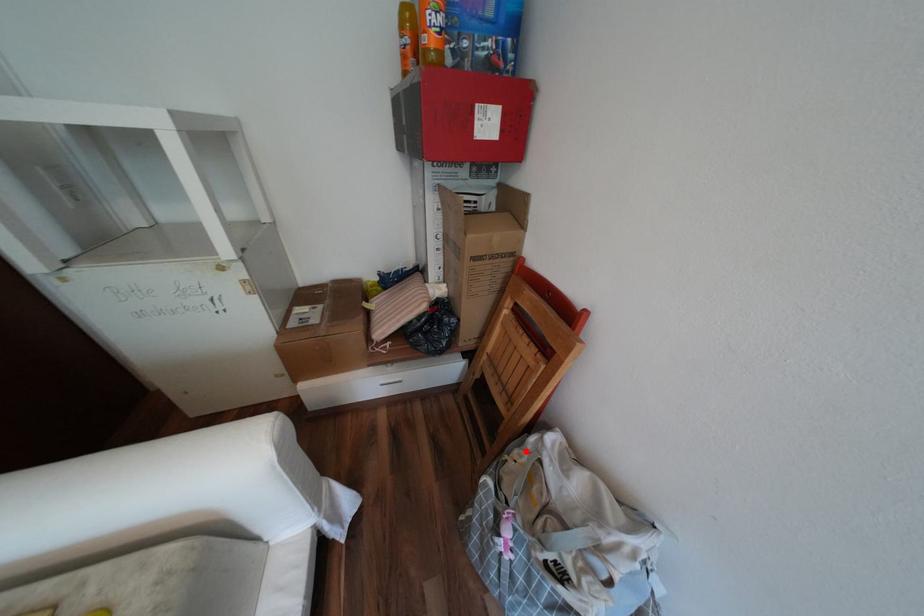
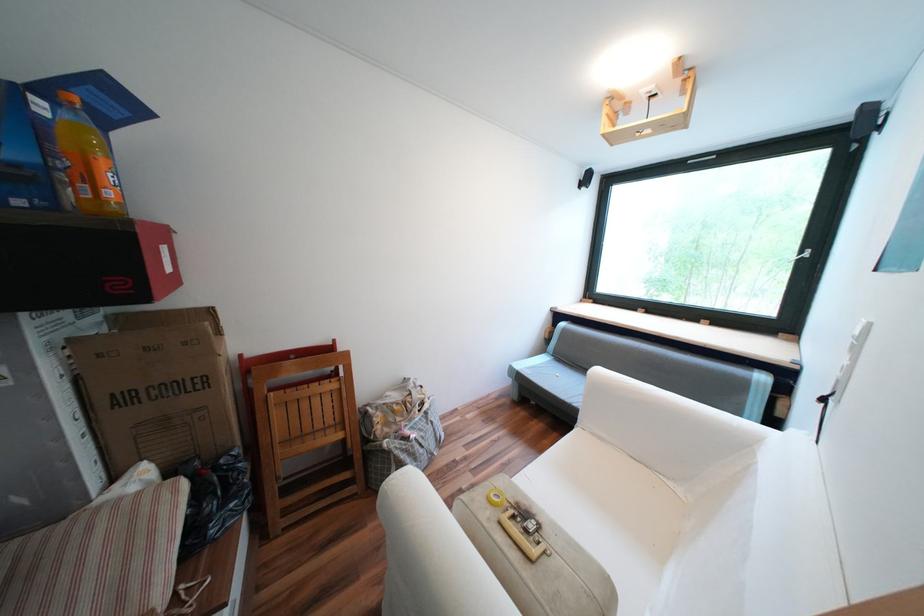
Find the pixel in the second image that matches the highlighted location in the first image.

(383, 419)